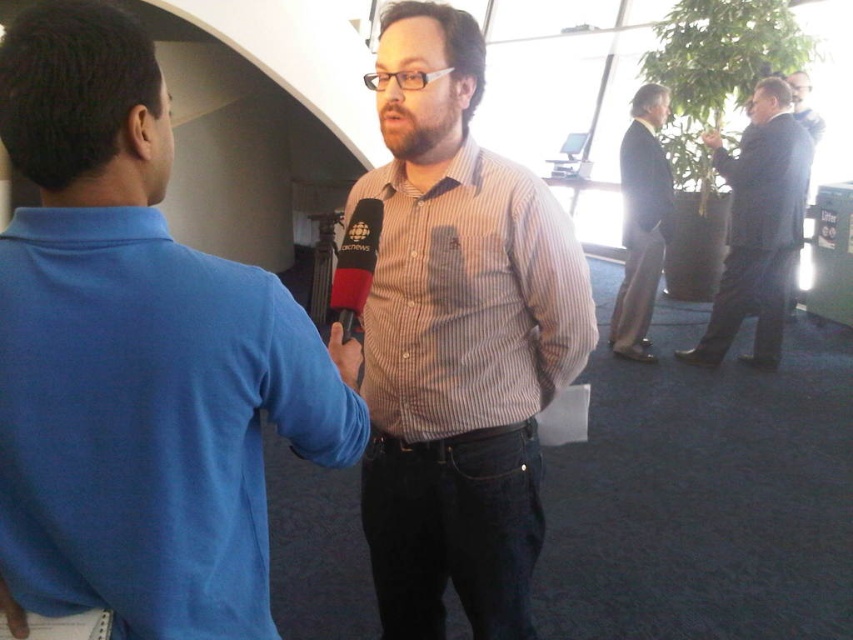
Is striped cotton shirt at center above matte black microphone at center?

No.

Which is in front, point (473, 147) or point (340, 330)?

Positioned in front is point (340, 330).

Where is `striped cotton shirt at center`? striped cotton shirt at center is located at coordinates (457, 339).

Does brown striped shirt at center come behind dark brown suit at upper right?

That is False.

Between point (514, 262) and point (637, 205), which one is positioned in front?

Point (514, 262) is more forward.

The height and width of the screenshot is (640, 853). In order to click on brown striped shirt at center in this screenshot , I will do [x=469, y=298].

Can you confirm if dark brown suit at upper right is positioned below matte black microphone at center?

Incorrect, dark brown suit at upper right is not positioned below matte black microphone at center.

Is dark brown suit at upper right thinner than matte black microphone at center?

No.

Where is `dark brown suit at upper right`? dark brown suit at upper right is located at coordinates (641, 220).